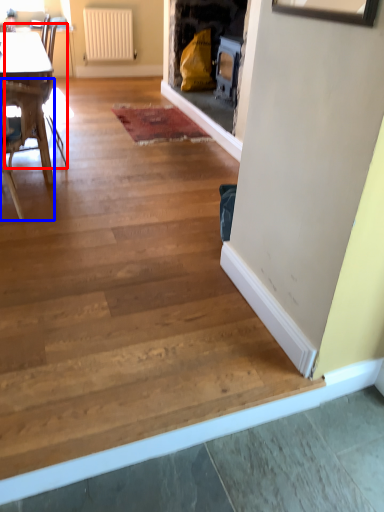
Question: Which point is further to the camera, armchair (highlighted by a red box) or chair (highlighted by a blue box)?

Choices:
 (A) armchair
 (B) chair

Answer: (A)